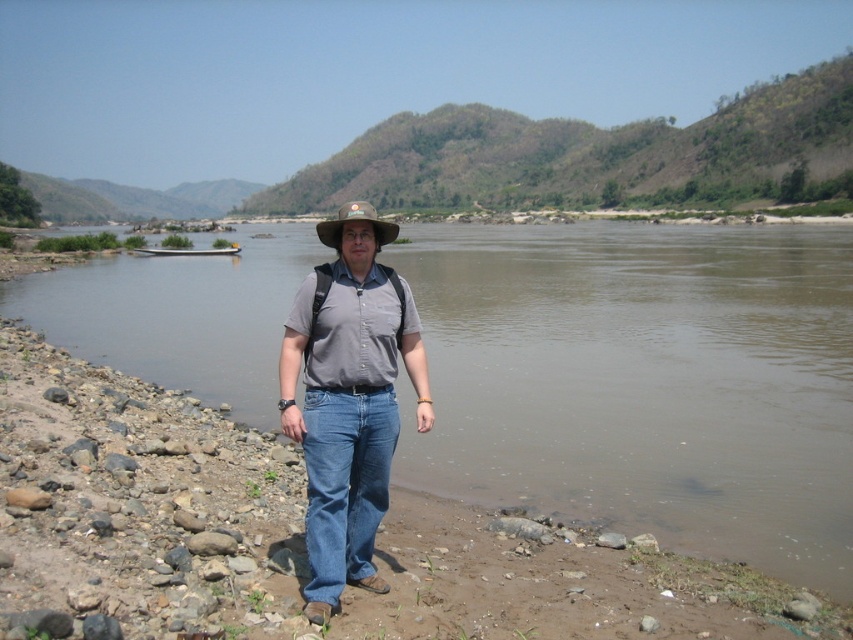
At what (x,y) coordinates should I click in order to perform the action: click on brown muddy water at center. Please return your answer as a coordinate pair (x, y). This screenshot has height=640, width=853. Looking at the image, I should click on (643, 381).

Locate an element on the screen. Image resolution: width=853 pixels, height=640 pixels. brown muddy water at center is located at coordinates (643, 381).

Is gray matte shirt at center above brown straw hat at center?

No, gray matte shirt at center is not above brown straw hat at center.

Is point (376, 237) less distant than point (334, 232)?

No, (376, 237) is further to viewer.

Which is in front, point (326, 323) or point (346, 218)?

Point (326, 323) is in front.

The image size is (853, 640). I want to click on gray matte shirt at center, so click(x=347, y=397).

Is brown muddy water at center to the left of brown straw hat at center from the viewer's perspective?

In fact, brown muddy water at center is to the right of brown straw hat at center.

Who is shorter, brown muddy water at center or brown straw hat at center?

With less height is brown straw hat at center.

Is point (677, 420) farther from viewer compared to point (363, 204)?

Yes.

I want to click on brown muddy water at center, so click(643, 381).